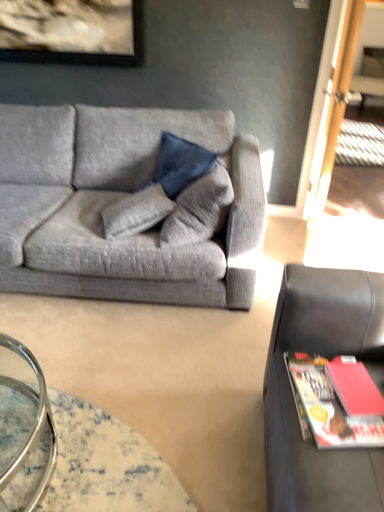
Identify the location of translucent glass table at lower left. The width and height of the screenshot is (384, 512). (106, 465).

The width and height of the screenshot is (384, 512). What do you see at coordinates (116, 201) in the screenshot?
I see `textured gray couch at left, the 1th studio couch when ordered from back to front` at bounding box center [116, 201].

Find the location of a particular element. The height and width of the screenshot is (512, 384). black leather studio couch at right, which appears as the second studio couch when viewed from the back is located at coordinates (293, 398).

The image size is (384, 512). Find the location of `translucent glass table at lower left`. translucent glass table at lower left is located at coordinates (106, 465).

Relative to black leather studio couch at right, which appears as the second studio couch when viewed from the back, is textured gray couch at left, the 2th studio couch when ordered from front to back, in front or behind?

In the image, textured gray couch at left, the 2th studio couch when ordered from front to back, appears behind black leather studio couch at right, which appears as the second studio couch when viewed from the back.

Considering the sizes of objects textured gray couch at left, the first studio couch positioned from the left, and black leather studio couch at right, acting as the second studio couch starting from the left, in the image provided, who is wider, textured gray couch at left, the first studio couch positioned from the left, or black leather studio couch at right, acting as the second studio couch starting from the left,?

Wider between the two is textured gray couch at left, the first studio couch positioned from the left.

Choose the correct answer: Is textured gray couch at left, the 2th studio couch when ordered from front to back, inside black leather studio couch at right, which ranks as the 1th studio couch in right-to-left order, or outside it?

textured gray couch at left, the 2th studio couch when ordered from front to back, is spatially situated outside black leather studio couch at right, which ranks as the 1th studio couch in right-to-left order.

Is textured gray couch at left, the 2th studio couch when ordered from front to back, far from black leather studio couch at right, acting as the second studio couch starting from the left?

textured gray couch at left, the 2th studio couch when ordered from front to back, is far away from black leather studio couch at right, acting as the second studio couch starting from the left.

Based on the photo, considering the relative sizes of textured gray couch at left, the 2th studio couch when ordered from front to back, and translucent glass table at lower left in the image provided, is textured gray couch at left, the 2th studio couch when ordered from front to back, thinner than translucent glass table at lower left?

No.

Is textured gray couch at left, the 2th studio couch when ordered from front to back, touching translucent glass table at lower left?

No, textured gray couch at left, the 2th studio couch when ordered from front to back, is not making contact with translucent glass table at lower left.

Does textured gray couch at left, the 2th studio couch when ordered from front to back, have a larger size compared to translucent glass table at lower left?

Indeed, textured gray couch at left, the 2th studio couch when ordered from front to back, has a larger size compared to translucent glass table at lower left.

Based on the photo, which is closer, (x=3, y=150) or (x=111, y=439)?

The point (x=111, y=439) is closer.

What's the angular difference between translucent glass table at lower left and red matte magazine at right's facing directions?

translucent glass table at lower left and red matte magazine at right are facing 171 degrees away from each other.

Could you tell me if translucent glass table at lower left is turned towards red matte magazine at right?

No, translucent glass table at lower left is not facing towards red matte magazine at right.

Considering the sizes of objects translucent glass table at lower left and red matte magazine at right in the image provided, who is taller, translucent glass table at lower left or red matte magazine at right?

Standing taller between the two is translucent glass table at lower left.

From a real-world perspective, does matte red book at lower right stand above black leather studio couch at right, which ranks as the 1th studio couch in right-to-left order?

Indeed, from a real-world perspective, matte red book at lower right stands above black leather studio couch at right, which ranks as the 1th studio couch in right-to-left order.

Does matte red book at lower right touch black leather studio couch at right, which ranks as the 1th studio couch in right-to-left order?

matte red book at lower right is not next to black leather studio couch at right, which ranks as the 1th studio couch in right-to-left order, and they're not touching.

The width and height of the screenshot is (384, 512). Find the location of `book above the black leather studio couch at right, which appears as the second studio couch when viewed from the back (from the image's perspective)`. book above the black leather studio couch at right, which appears as the second studio couch when viewed from the back (from the image's perspective) is located at coordinates (354, 388).

From the picture: Considering the sizes of objects matte red book at lower right and black leather studio couch at right, which ranks as the 1th studio couch in right-to-left order, in the image provided, who is taller, matte red book at lower right or black leather studio couch at right, which ranks as the 1th studio couch in right-to-left order,?

Standing taller between the two is black leather studio couch at right, which ranks as the 1th studio couch in right-to-left order.

From a real-world perspective, which object rests below the other?

In real-world perspective, black leather studio couch at right, which ranks as the 1th studio couch in right-to-left order, is lower.

Would you say red matte magazine at right is a long distance from black leather studio couch at right, which ranks as the 1th studio couch in right-to-left order?

No, red matte magazine at right is in close proximity to black leather studio couch at right, which ranks as the 1th studio couch in right-to-left order.

Is red matte magazine at right wider than black leather studio couch at right, which appears as the second studio couch when viewed from the back?

No, red matte magazine at right is not wider than black leather studio couch at right, which appears as the second studio couch when viewed from the back.

Can you confirm if red matte magazine at right is bigger than black leather studio couch at right, which appears as the second studio couch when viewed from the back?

No.

Does point (311, 437) appear closer or farther from the camera than point (15, 438)?

Point (311, 437) is closer to the camera than point (15, 438).

Can you confirm if red matte magazine at right is thinner than translucent glass table at lower left?

Yes, red matte magazine at right is thinner than translucent glass table at lower left.

From the image's perspective, is red matte magazine at right on translucent glass table at lower left?

Yes, from the image's perspective, red matte magazine at right is above translucent glass table at lower left.

Is red matte magazine at right looking in the opposite direction of translucent glass table at lower left?

That's not correct — red matte magazine at right is not looking away from translucent glass table at lower left.

Which is correct: black leather studio couch at right, which ranks as the 1th studio couch in right-to-left order, is inside translucent glass table at lower left, or outside of it?

black leather studio couch at right, which ranks as the 1th studio couch in right-to-left order, is outside translucent glass table at lower left.

Looking at the image, does black leather studio couch at right, positioned as the first studio couch in front-to-back order, seem bigger or smaller compared to translucent glass table at lower left?

Clearly, black leather studio couch at right, positioned as the first studio couch in front-to-back order, is larger in size than translucent glass table at lower left.

Is black leather studio couch at right, acting as the second studio couch starting from the left, not near translucent glass table at lower left?

A: No.

Is black leather studio couch at right, which ranks as the 1th studio couch in right-to-left order, facing away from translucent glass table at lower left?

No.

At what (x,y) coordinates should I click in order to perform the action: click on studio couch above the black leather studio couch at right, acting as the second studio couch starting from the left (from a real-world perspective). Please return your answer as a coordinate pair (x, y). This screenshot has height=512, width=384. Looking at the image, I should click on (116, 201).

Where is `studio couch located behind the translucent glass table at lower left`? The height and width of the screenshot is (512, 384). studio couch located behind the translucent glass table at lower left is located at coordinates (116, 201).

When comparing their distances from matte red book at lower right, does textured gray couch at left, the 2th studio couch when ordered from front to back, or red matte magazine at right seem further?

Based on the image, textured gray couch at left, the 2th studio couch when ordered from front to back, appears to be further to matte red book at lower right.

From the picture: When comparing their distances from translucent glass table at lower left, does red matte magazine at right or matte red book at lower right seem further?

matte red book at lower right is positioned further to the anchor translucent glass table at lower left.

Looking at the image, which one is located further to translucent glass table at lower left, matte red book at lower right or black leather studio couch at right, which ranks as the 1th studio couch in right-to-left order?

Based on the image, matte red book at lower right appears to be further to translucent glass table at lower left.

Estimate the real-world distances between objects in this image. Which object is further from red matte magazine at right, matte red book at lower right or textured gray couch at left, the first studio couch positioned from the left?

The object further to red matte magazine at right is textured gray couch at left, the first studio couch positioned from the left.

Based on the photo, from the image, which object appears to be nearer to textured gray couch at left, the 1th studio couch when ordered from back to front, matte red book at lower right or black leather studio couch at right, acting as the second studio couch starting from the left?

black leather studio couch at right, acting as the second studio couch starting from the left, lies closer to textured gray couch at left, the 1th studio couch when ordered from back to front, than the other object.

Estimate the real-world distances between objects in this image. Which object is further from red matte magazine at right, matte red book at lower right or black leather studio couch at right, which appears as the second studio couch when viewed from the back?

Among the two, black leather studio couch at right, which appears as the second studio couch when viewed from the back, is located further to red matte magazine at right.

From the image, which object appears to be nearer to matte red book at lower right, textured gray couch at left, which is counted as the second studio couch, starting from the right, or translucent glass table at lower left?

translucent glass table at lower left.

Looking at the image, which one is located further to matte red book at lower right, translucent glass table at lower left or red matte magazine at right?

The object further to matte red book at lower right is translucent glass table at lower left.

Image resolution: width=384 pixels, height=512 pixels. I want to click on table located between textured gray couch at left, the 1th studio couch when ordered from back to front, and black leather studio couch at right, which appears as the second studio couch when viewed from the back, in the left-right direction, so 106,465.

Where is `table between textured gray couch at left, which is counted as the second studio couch, starting from the right, and matte red book at lower right from left to right`? table between textured gray couch at left, which is counted as the second studio couch, starting from the right, and matte red book at lower right from left to right is located at coordinates (106, 465).

At what (x,y) coordinates should I click in order to perform the action: click on book between textured gray couch at left, the 2th studio couch when ordered from front to back, and black leather studio couch at right, which ranks as the 1th studio couch in right-to-left order. Please return your answer as a coordinate pair (x, y). Looking at the image, I should click on (x=354, y=388).

You are a GUI agent. You are given a task and a screenshot of the screen. Output one action in this format:
    pyautogui.click(x=<x>, y=<y>)
    Task: Click on the magazine between black leather studio couch at right, acting as the second studio couch starting from the left, and matte red book at lower right, along the z-axis
    The height and width of the screenshot is (512, 384).
    Given the screenshot: What is the action you would take?
    pyautogui.click(x=327, y=408)